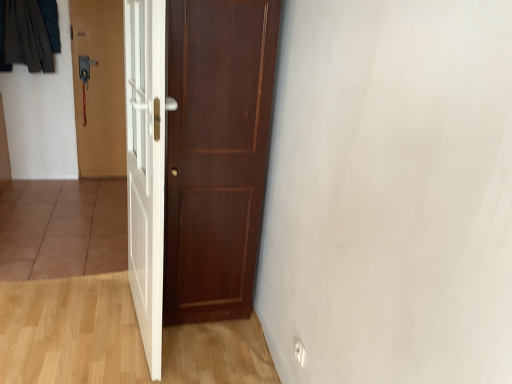
Where is `vacant region to the left of wooden door at left, the third door positioned from the right`? vacant region to the left of wooden door at left, the third door positioned from the right is located at coordinates (72, 181).